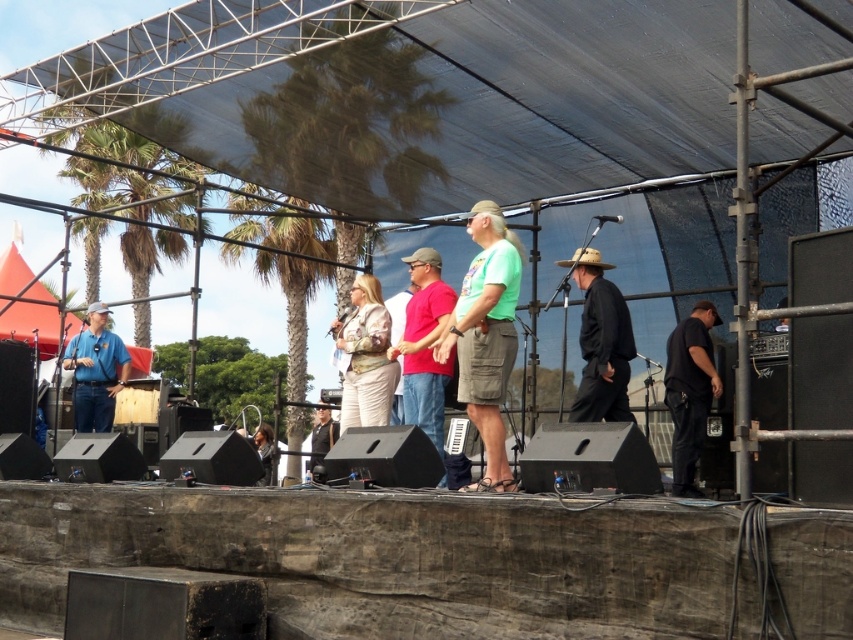
Question: Which object appears farthest from the camera in this image?

Choices:
 (A) black cotton shirt at center
 (B) blue jeans at left
 (C) matte white blouse at center

Answer: (B)

Question: Does blue jeans at left appear over black leather jacket at center?

Choices:
 (A) no
 (B) yes

Answer: (B)

Question: Is black matte pants at right in front of black leather jacket at center?

Choices:
 (A) no
 (B) yes

Answer: (A)

Question: Is black cotton shirt at center to the left of matte white blouse at center from the viewer's perspective?

Choices:
 (A) no
 (B) yes

Answer: (A)

Question: Among these points, which one is farthest from the camera?

Choices:
 (A) (97, 324)
 (B) (270, 432)
 (C) (352, 282)
 (D) (607, 344)

Answer: (B)

Question: Estimate the real-world distances between objects in this image. Which object is farther from the black matte pants at right?

Choices:
 (A) blue jeans at left
 (B) matte red shirt at center
 (C) black leather jacket at center
 (D) dark brown leather jacket at lower center

Answer: (A)